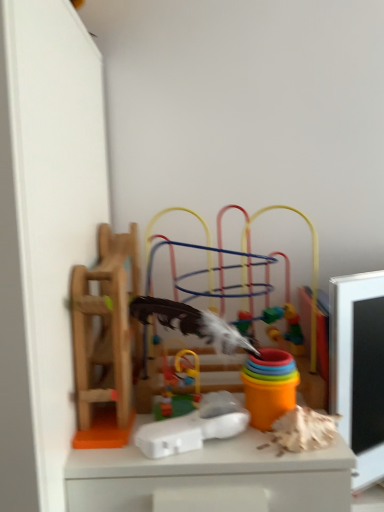
Question: Does multicolored plastic toy at center, acting as the 4th toy starting from the left, have a greater width compared to rubberized plastic toy at center, which is the third toy from right to left?

Choices:
 (A) yes
 (B) no

Answer: (A)

Question: Is the depth of multicolored plastic toy at center, the first toy viewed from the right, less than that of rubberized plastic toy at center, which is the third toy from right to left?

Choices:
 (A) yes
 (B) no

Answer: (B)

Question: Is rubberized plastic toy at center, which is the third toy from right to left, located within multicolored plastic toy at center, acting as the 4th toy starting from the left?

Choices:
 (A) no
 (B) yes

Answer: (A)

Question: Is multicolored plastic toy at center, acting as the 4th toy starting from the left, facing towards rubberized plastic toy at center, which is the third toy from right to left?

Choices:
 (A) no
 (B) yes

Answer: (B)

Question: From the image's perspective, does multicolored plastic toy at center, acting as the 4th toy starting from the left, appear higher than rubberized plastic toy at center, which appears as the 2th toy when viewed from the left?

Choices:
 (A) yes
 (B) no

Answer: (A)

Question: Can you confirm if multicolored plastic toy at center, acting as the 4th toy starting from the left, is thinner than rubberized plastic toy at center, which appears as the 2th toy when viewed from the left?

Choices:
 (A) yes
 (B) no

Answer: (B)

Question: From the image's perspective, does white plastic toy at center, which ranks as the third toy in left-to-right order, appear higher than multicolored plastic toy at center, the first toy viewed from the right?

Choices:
 (A) yes
 (B) no

Answer: (B)

Question: Is white plastic toy at center, which ranks as the third toy in left-to-right order, not close to multicolored plastic toy at center, acting as the 4th toy starting from the left?

Choices:
 (A) no
 (B) yes

Answer: (A)

Question: Could multicolored plastic toy at center, acting as the 4th toy starting from the left, be considered to be inside white plastic toy at center, which ranks as the third toy in left-to-right order?

Choices:
 (A) yes
 (B) no

Answer: (B)

Question: Is white plastic toy at center, which ranks as the 2th toy in right-to-left order, aimed at multicolored plastic toy at center, the first toy viewed from the right?

Choices:
 (A) yes
 (B) no

Answer: (B)

Question: From a real-world perspective, is white plastic toy at center, which ranks as the third toy in left-to-right order, positioned under multicolored plastic toy at center, acting as the 4th toy starting from the left, based on gravity?

Choices:
 (A) yes
 (B) no

Answer: (A)

Question: Does white plastic toy at center, which ranks as the 2th toy in right-to-left order, have a greater width compared to multicolored plastic toy at center, acting as the 4th toy starting from the left?

Choices:
 (A) no
 (B) yes

Answer: (A)

Question: Does multicolored plastic toy at center, the first toy viewed from the right, have a larger size compared to white plastic toy at center, which ranks as the third toy in left-to-right order?

Choices:
 (A) yes
 (B) no

Answer: (A)